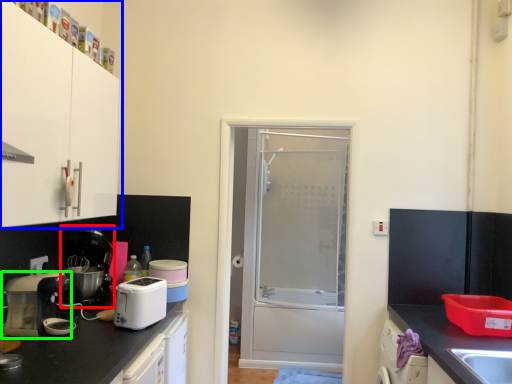
Question: Based on their relative distances, which object is farther from coffee machine (highlighted by a red box)? Choose from cabinetry (highlighted by a blue box) and home appliance (highlighted by a green box).

Choices:
 (A) cabinetry
 (B) home appliance

Answer: (A)